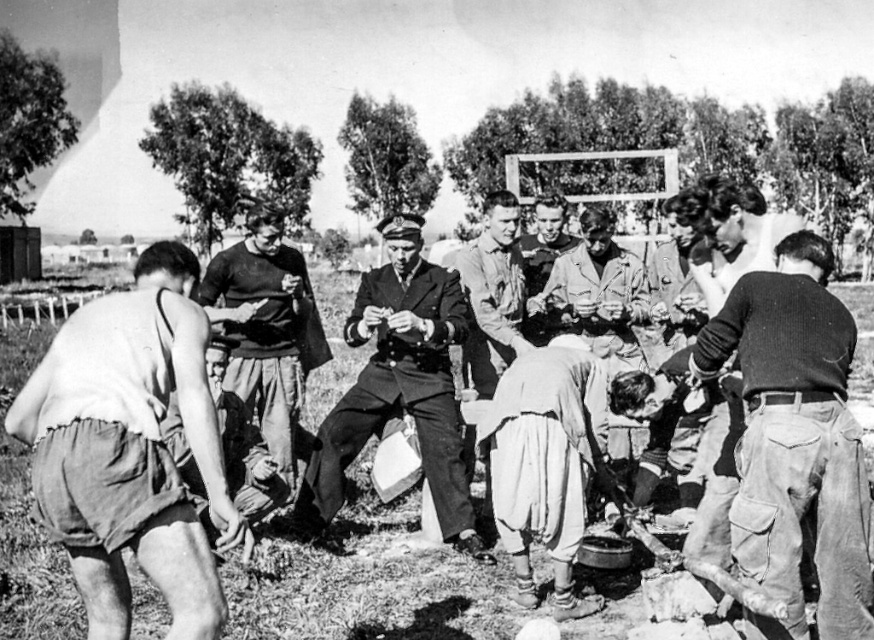
Question: Considering the real-world distances, which object is farthest from the dirty shorts at left?

Choices:
 (A) dark wool sweater at center right
 (B) dark gray sweater at center

Answer: (B)

Question: Can you confirm if dirty shorts at left is positioned above uniformed man at center?

Choices:
 (A) yes
 (B) no

Answer: (B)

Question: Is dirty shorts at left behind dark wool sweater at center right?

Choices:
 (A) yes
 (B) no

Answer: (B)

Question: Which of these objects is positioned closest to the uniformed man at center?

Choices:
 (A) dirty shorts at left
 (B) dark wool sweater at center right
 (C) smooth leather jacket at center
 (D) dark gray sweater at center

Answer: (D)

Question: Which is nearer to the smooth leather jacket at center?

Choices:
 (A) uniformed man at center
 (B) dirty shorts at left
 (C) dark wool sweater at center right
 (D) dark gray sweater at center

Answer: (A)

Question: Is dirty shorts at left positioned behind dark gray sweater at center?

Choices:
 (A) no
 (B) yes

Answer: (A)